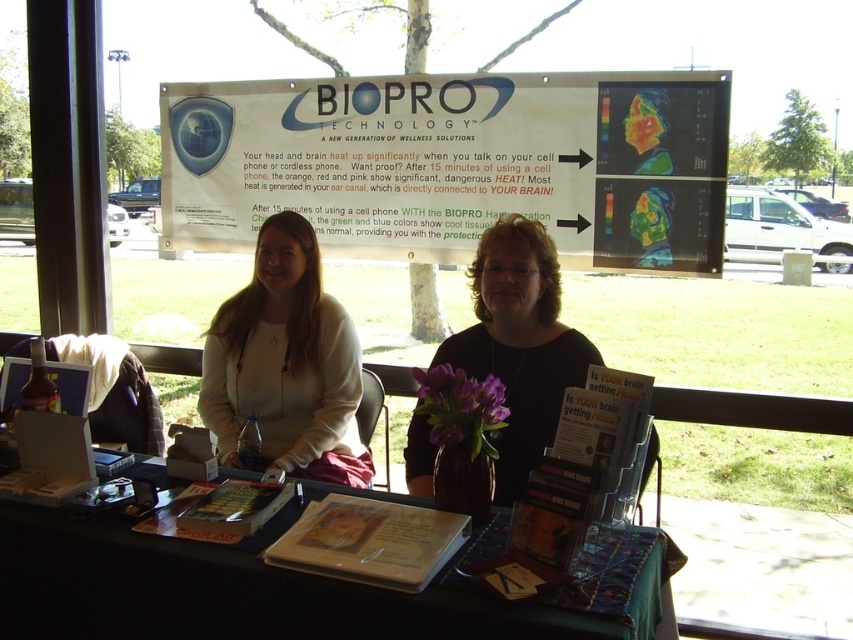
Question: Can you confirm if wooden table at center is thinner than matte white sweater at center?

Choices:
 (A) yes
 (B) no

Answer: (B)

Question: Does wooden table at center have a lesser width compared to matte white sweater at center?

Choices:
 (A) yes
 (B) no

Answer: (B)

Question: Estimate the real-world distances between objects in this image. Which object is farther from the wooden table at center?

Choices:
 (A) black matte shirt at center
 (B) white paper at upper center

Answer: (B)

Question: Which point is farther to the camera?

Choices:
 (A) wooden table at center
 (B) black matte shirt at center
 (C) white paper at upper center

Answer: (C)

Question: Which of the following is the farthest from the observer?

Choices:
 (A) white paper at upper center
 (B) black matte shirt at center

Answer: (A)

Question: Can you confirm if white paper at upper center is wider than wooden table at center?

Choices:
 (A) yes
 (B) no

Answer: (A)